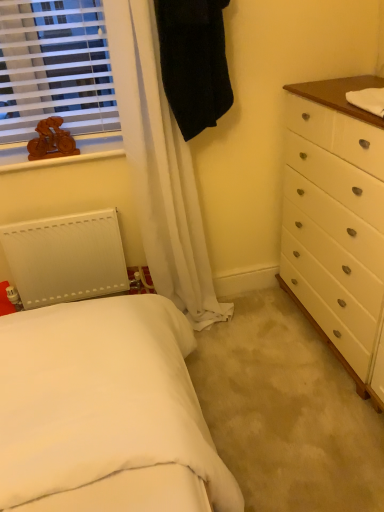
You are a GUI agent. You are given a task and a screenshot of the screen. Output one action in this format:
    pyautogui.click(x=<x>, y=<y>)
    Task: Click on the empty space that is to the right of wooden bicycle at upper left
    The image size is (384, 512).
    Given the screenshot: What is the action you would take?
    pyautogui.click(x=94, y=148)